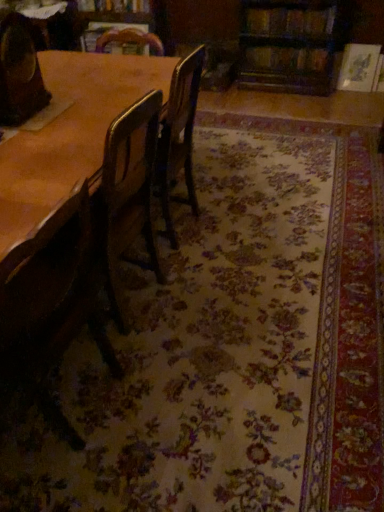
Identify the location of free space in front of wooden chair at left, which is the second chair in bottom-to-top order. The width and height of the screenshot is (384, 512). (29, 132).